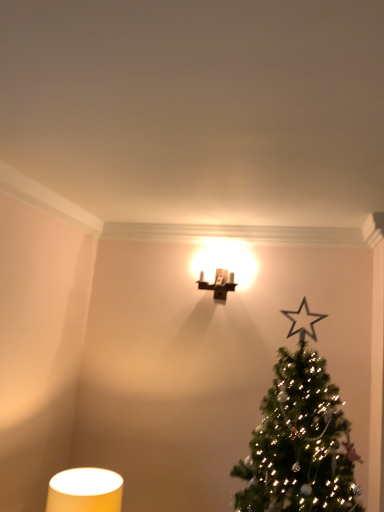
Question: Is matte brown wall sconce at upper center, positioned as the second table lamp in left-to-right order, bigger than matte yellow cylindrical lampshade at lower left, placed as the first table lamp when sorted from bottom to top?

Choices:
 (A) yes
 (B) no

Answer: (B)

Question: Are matte brown wall sconce at upper center, the 1th table lamp from the right, and matte yellow cylindrical lampshade at lower left, acting as the 2th table lamp starting from the right, far apart?

Choices:
 (A) yes
 (B) no

Answer: (A)

Question: Can you confirm if matte brown wall sconce at upper center, the 1th table lamp from the right, is positioned to the right of matte yellow cylindrical lampshade at lower left, arranged as the 1th table lamp when viewed from the front?

Choices:
 (A) no
 (B) yes

Answer: (B)

Question: From the image's perspective, is matte brown wall sconce at upper center, which is the second table lamp in front-to-back order, on matte yellow cylindrical lampshade at lower left, the 2th table lamp viewed from the back?

Choices:
 (A) no
 (B) yes

Answer: (B)

Question: Is matte yellow cylindrical lampshade at lower left, arranged as the 1th table lamp when viewed from the front, completely or partially inside matte brown wall sconce at upper center, positioned as the second table lamp in left-to-right order?

Choices:
 (A) no
 (B) yes

Answer: (A)

Question: Considering the positions of point (x=226, y=274) and point (x=79, y=488), is point (x=226, y=274) closer or farther from the camera than point (x=79, y=488)?

Choices:
 (A) closer
 (B) farther

Answer: (B)

Question: Is matte brown wall sconce at upper center, which is the second table lamp in front-to-back order, wider or thinner than matte yellow cylindrical lampshade at lower left, placed as the first table lamp when sorted from bottom to top?

Choices:
 (A) thin
 (B) wide

Answer: (A)

Question: Based on their sizes in the image, would you say matte brown wall sconce at upper center, marked as the first table lamp in a top-to-bottom arrangement, is bigger or smaller than matte yellow cylindrical lampshade at lower left, which appears as the second table lamp when viewed from the top?

Choices:
 (A) small
 (B) big

Answer: (A)

Question: Choose the correct answer: Is matte brown wall sconce at upper center, the 2th table lamp when ordered from bottom to top, inside matte yellow cylindrical lampshade at lower left, acting as the 2th table lamp starting from the right, or outside it?

Choices:
 (A) inside
 (B) outside

Answer: (B)

Question: Visually, is green matte christmas tree at upper right positioned to the left or to the right of matte yellow cylindrical lampshade at lower left, placed as the first table lamp when sorted from bottom to top?

Choices:
 (A) left
 (B) right

Answer: (B)

Question: From the image's perspective, is green matte christmas tree at upper right located above or below matte yellow cylindrical lampshade at lower left, the 2th table lamp viewed from the back?

Choices:
 (A) above
 (B) below

Answer: (A)

Question: In terms of height, does green matte christmas tree at upper right look taller or shorter compared to matte yellow cylindrical lampshade at lower left, placed as the first table lamp when sorted from bottom to top?

Choices:
 (A) short
 (B) tall

Answer: (B)

Question: Considering their positions, is green matte christmas tree at upper right located in front of or behind matte yellow cylindrical lampshade at lower left, placed as the first table lamp when sorted from bottom to top?

Choices:
 (A) behind
 (B) front

Answer: (B)

Question: Considering the positions of matte yellow cylindrical lampshade at lower left, acting as the 2th table lamp starting from the right, and green matte christmas tree at upper right in the image, is matte yellow cylindrical lampshade at lower left, acting as the 2th table lamp starting from the right, taller or shorter than green matte christmas tree at upper right?

Choices:
 (A) tall
 (B) short

Answer: (B)

Question: From a real-world perspective, is matte yellow cylindrical lampshade at lower left, which appears as the second table lamp when viewed from the top, physically located above or below green matte christmas tree at upper right?

Choices:
 (A) below
 (B) above

Answer: (A)